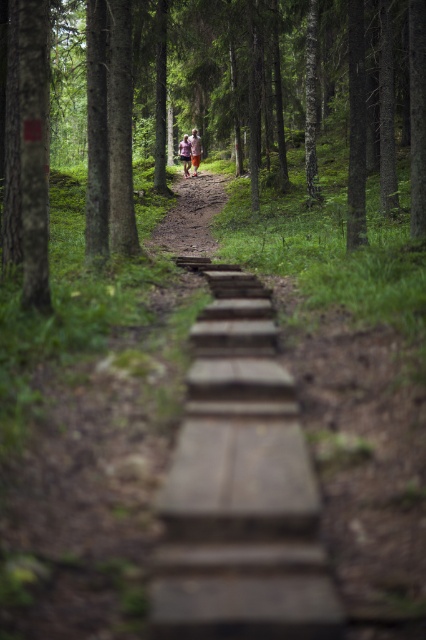
Question: Does wooden steps at center appear on the left side of white fabric person at center?

Choices:
 (A) no
 (B) yes

Answer: (A)

Question: Which is nearer to the pink fabric person at center?

Choices:
 (A) brown wooden trail at center
 (B) wooden steps at center
 (C) green matte tree at center

Answer: (A)

Question: Is wooden steps at center wider than pink fabric person at center?

Choices:
 (A) no
 (B) yes

Answer: (B)

Question: Which point is closer to the camera?

Choices:
 (A) wooden steps at center
 (B) white fabric person at center

Answer: (A)

Question: Which object appears closest to the camera in this image?

Choices:
 (A) wooden steps at center
 (B) pink fabric person at center
 (C) green matte tree at center
 (D) brown wooden trail at center

Answer: (A)

Question: Considering the relative positions of green matte tree at center and wooden steps at center in the image provided, where is green matte tree at center located with respect to wooden steps at center?

Choices:
 (A) right
 (B) left

Answer: (B)